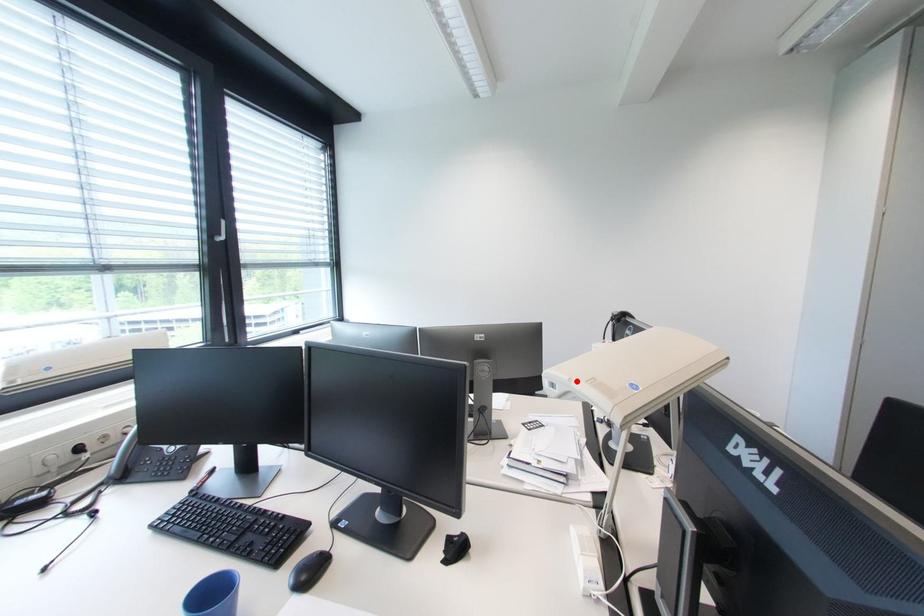
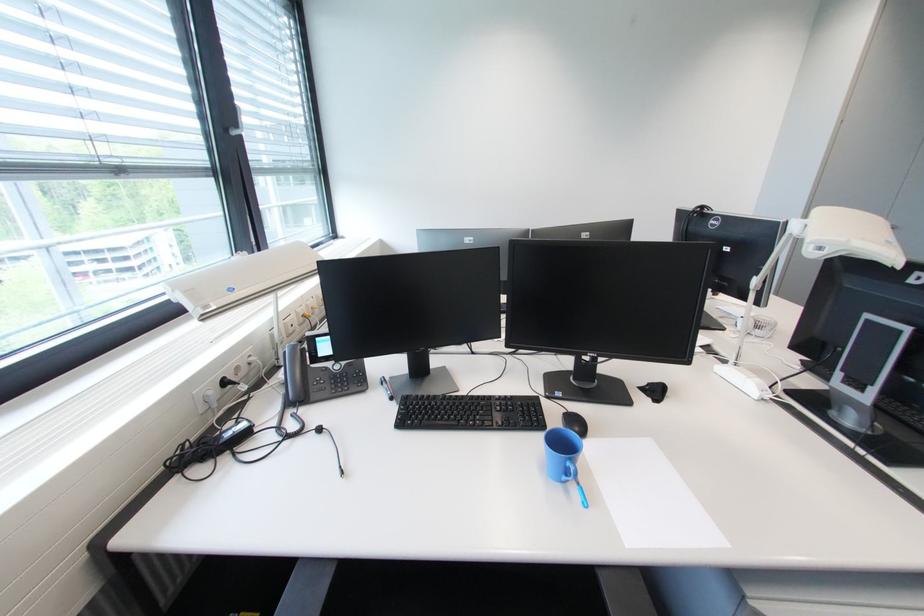
Question: A red point is marked in image1. In image2, is the corresponding 3D point closer to the camera or farther? Reply with the corresponding letter.

Choices:
 (A) The corresponding 3D point is closer.
 (B) The corresponding 3D point is farther.

Answer: (A)